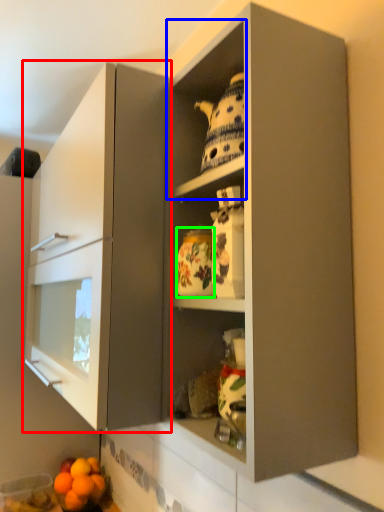
Question: Based on their relative distances, which object is nearer to cabinetry (highlighted by a red box)? Choose from cabinet (highlighted by a blue box) and pottery (highlighted by a green box).

Choices:
 (A) cabinet
 (B) pottery

Answer: (A)